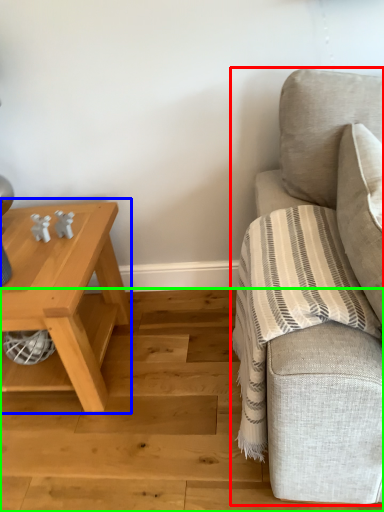
Question: Estimate the real-world distances between objects in this image. Which object is closer to studio couch (highlighted by a red box), table (highlighted by a blue box) or stair (highlighted by a green box)?

Choices:
 (A) table
 (B) stair

Answer: (B)